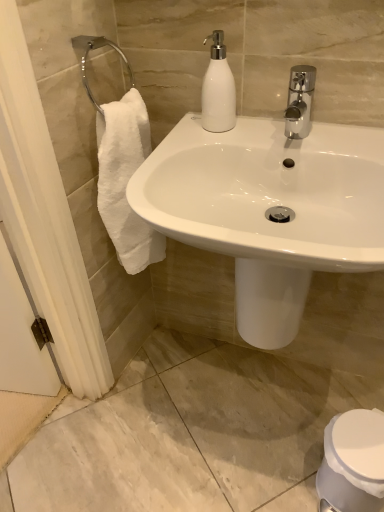
Locate an element on the screen. This screenshot has height=512, width=384. unoccupied region to the right of white glossy soap dispenser at upper center is located at coordinates (282, 132).